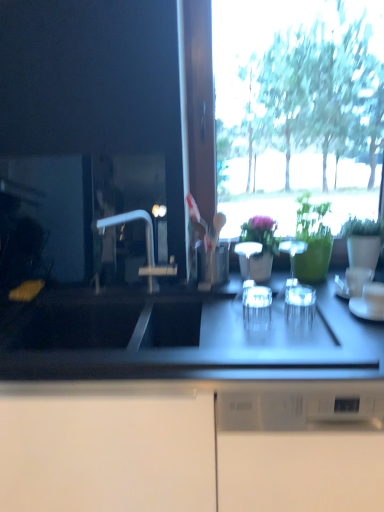
Question: From their relative heights in the image, would you say white glossy cup at center, which is counted as the 3th tableware, starting from the right, is taller or shorter than clear glass at center, placed as the 1th tableware when sorted from left to right?

Choices:
 (A) short
 (B) tall

Answer: (A)

Question: From the image's perspective, is white glossy cup at center, the fourth tableware viewed from the left, positioned above or below clear glass at center, placed as the 1th tableware when sorted from left to right?

Choices:
 (A) above
 (B) below

Answer: (B)

Question: Considering the real-world distances, which object is closest to the transparent glass at center, which is counted as the 3th tableware, starting from the left?

Choices:
 (A) white glossy cup at center, which is counted as the 3th tableware, starting from the right
 (B) green matte vase at center, marked as the second houseplant in a right-to-left arrangement
 (C) clear glass at center, placed as the 1th tableware when sorted from left to right
 (D) clear glass wine glasses at center, positioned as the 5th tableware in right-to-left order
 (E) clear glass cup at right, the second tableware from the right

Answer: (C)

Question: Based on their relative distances, which object is farther from the white glossy cup at right, the first tableware positioned from the right?

Choices:
 (A) transparent glass at center, which is counted as the 3th tableware, starting from the left
 (B) green matte vase at center, which is counted as the 1th houseplant, starting from the left
 (C) clear glass cup at right, the second tableware from the right
 (D) clear glass wine glasses at center, positioned as the 5th tableware in right-to-left order
 (E) green glossy vase at upper right, the 1th houseplant viewed from the right

Answer: (B)